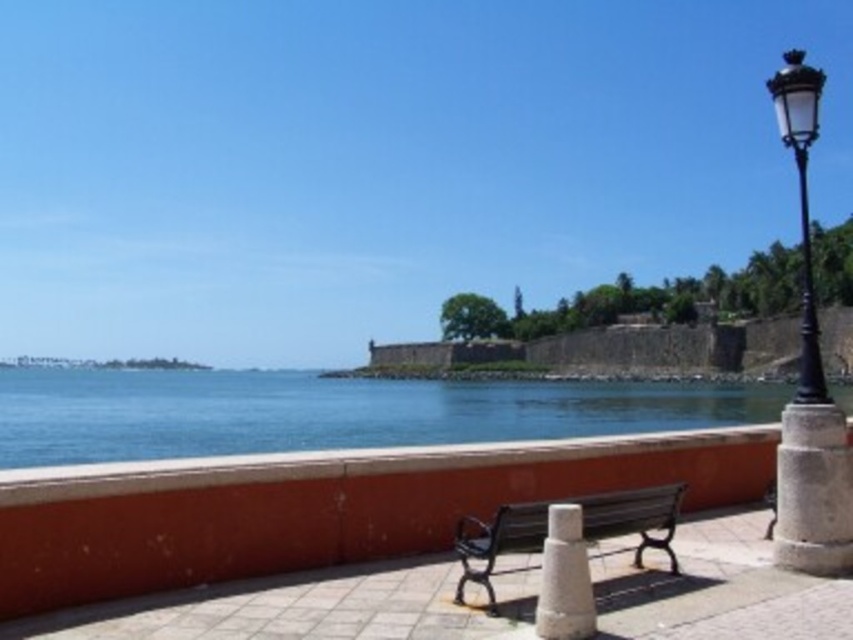
Can you confirm if blue water at center is positioned above white stone cone at center?

Incorrect, blue water at center is not positioned above white stone cone at center.

Is blue water at center wider than white stone cone at center?

Yes.

Locate an element on the screen. blue water at center is located at coordinates (334, 412).

Which is behind, point (824, 410) or point (575, 577)?

The point (824, 410) is more distant.

Is black metal/iron lamp post at right positioned behind white stone cone at center?

Yes.

Who is more distant from viewer, (802, 292) or (575, 582)?

The point (802, 292) is behind.

This screenshot has height=640, width=853. I want to click on black metal/iron lamp post at right, so click(809, 380).

Describe the element at coordinates (813, 490) in the screenshot. This screenshot has height=640, width=853. I see `gray stone pillar at right` at that location.

This screenshot has width=853, height=640. In order to click on gray stone pillar at right in this screenshot , I will do `click(813, 490)`.